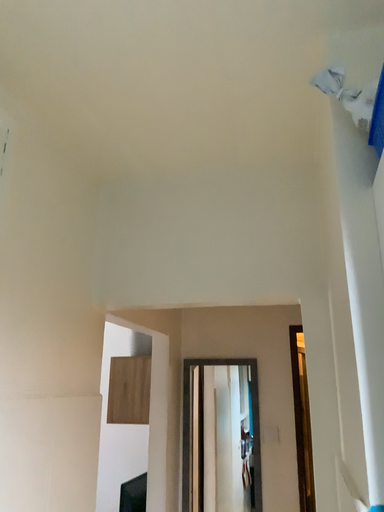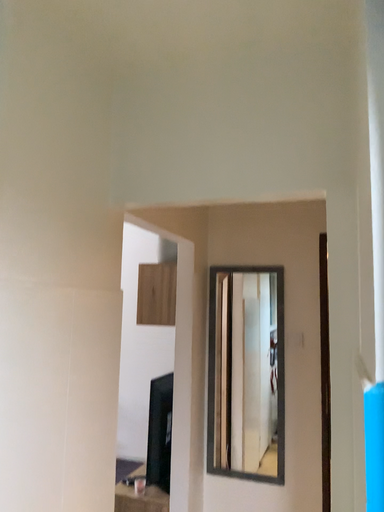
Question: Which way did the camera rotate in the video?

Choices:
 (A) rotated upward
 (B) rotated downward

Answer: (B)